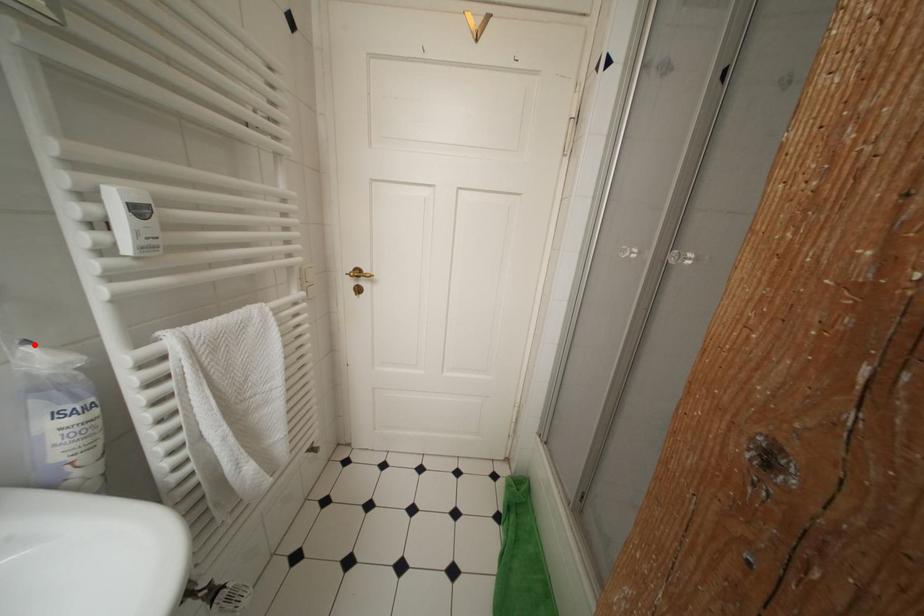
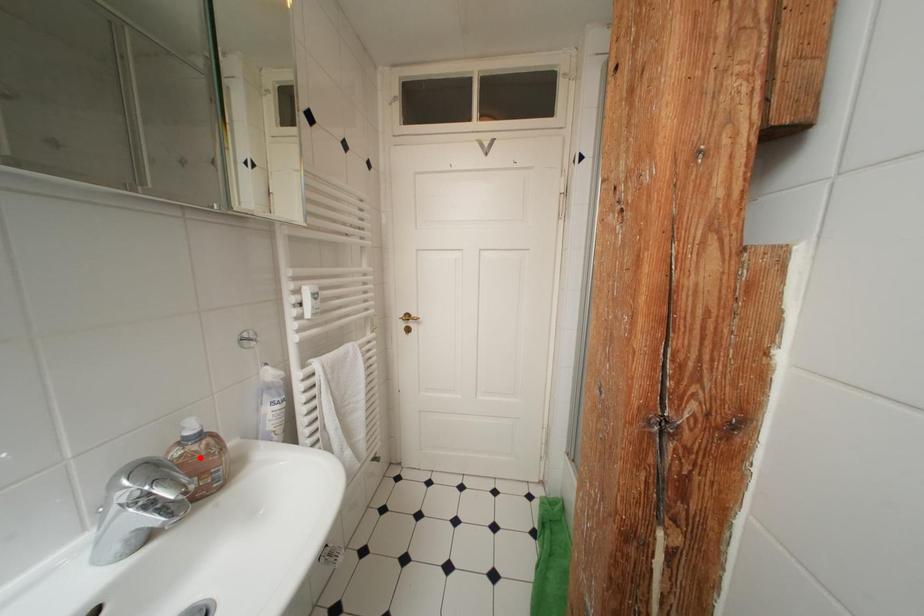
I am providing you with two images of the same scene from different viewpoints. A red point is marked on the first image and another point is marked on the second image. Are the points marked in image1 and image2 representing the same 3D position?

No